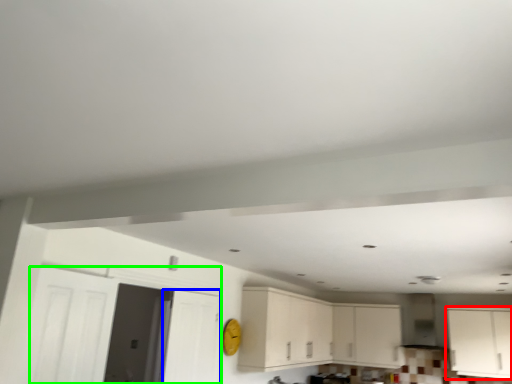
Question: Considering the real-world distances, which object is closest to cabinetry (highlighted by a red box)? door (highlighted by a blue box) or door (highlighted by a green box).

Choices:
 (A) door
 (B) door

Answer: (A)